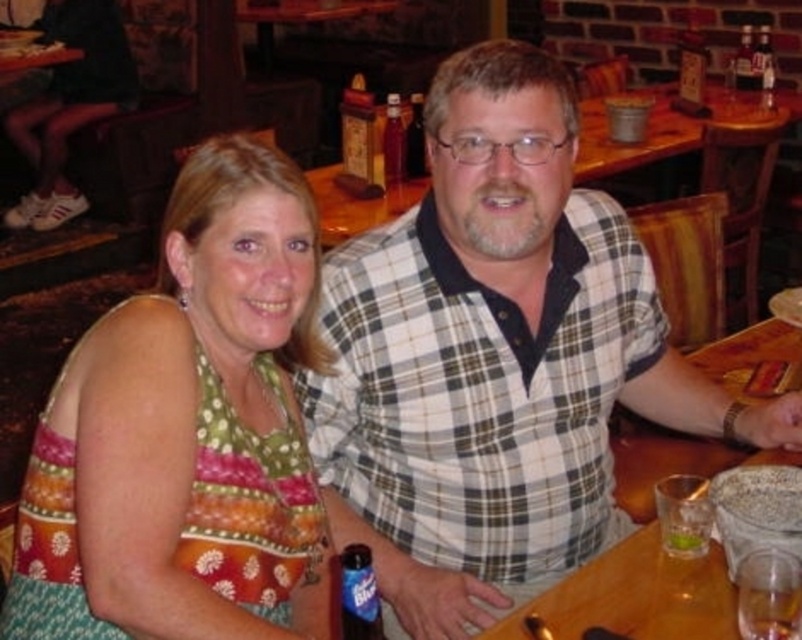
Question: Is multicolored fabric dress at center to the left of translucent glass bottle at upper right from the viewer's perspective?

Choices:
 (A) no
 (B) yes

Answer: (B)

Question: Which object appears farthest from the camera in this image?

Choices:
 (A) blue plastic bottle at lower center
 (B) translucent glass bottle at upper right

Answer: (B)

Question: Which is nearer to the translucent glass bottle at upper right?

Choices:
 (A) white checkered shirt at center
 (B) wooden table at center

Answer: (B)

Question: Considering the relative positions of wooden table at center and blue plastic bottle at lower center in the image provided, where is wooden table at center located with respect to blue plastic bottle at lower center?

Choices:
 (A) right
 (B) left

Answer: (A)

Question: Which object is farther from the camera taking this photo?

Choices:
 (A) blue plastic bottle at lower center
 (B) white checkered shirt at center

Answer: (B)

Question: Can you confirm if blue plastic bottle at lower center is positioned to the left of translucent glass bottle at upper right?

Choices:
 (A) yes
 (B) no

Answer: (A)